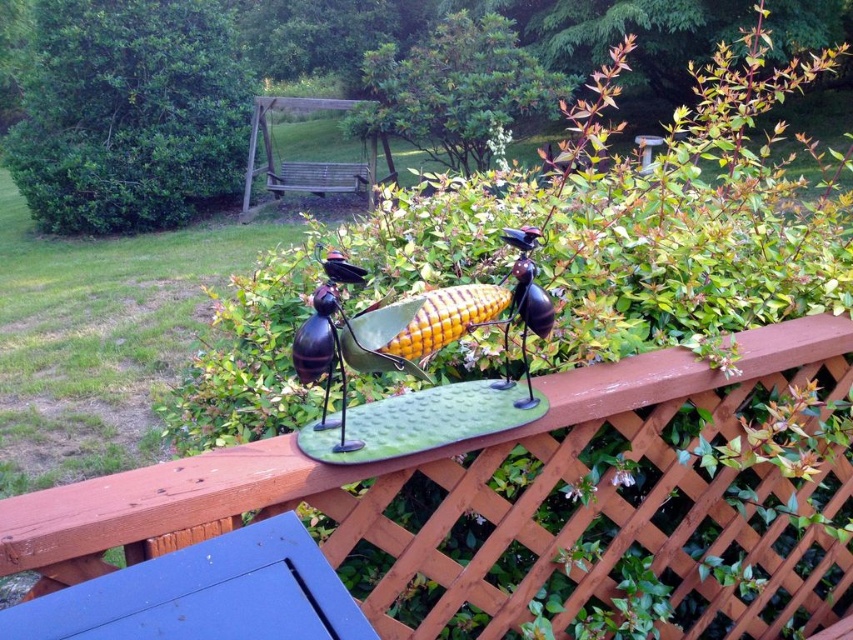
Does wooden lattice at center appear over green leafy bush at upper center?

Incorrect, wooden lattice at center is not positioned above green leafy bush at upper center.

This screenshot has width=853, height=640. What are the coordinates of `wooden lattice at center` in the screenshot? It's located at (x=473, y=497).

Is point (126, 506) farther from camera compared to point (503, 49)?

No, it is in front of (503, 49).

You are a GUI agent. You are given a task and a screenshot of the screen. Output one action in this format:
    pyautogui.click(x=<x>, y=<y>)
    Task: Click on the wooden lattice at center
    This screenshot has width=853, height=640.
    Given the screenshot: What is the action you would take?
    pyautogui.click(x=473, y=497)

Does green leafy bush at upper left have a lesser height compared to green leafy bush at upper center?

Incorrect, green leafy bush at upper left's height does not fall short of green leafy bush at upper center's.

How much distance is there between green leafy bush at upper left and green leafy bush at upper center?

They are 10.48 feet apart.

Who is more forward, (219, 65) or (430, 68)?

Positioned in front is point (430, 68).

The image size is (853, 640). In order to click on green leafy bush at upper left in this screenshot , I will do `click(129, 115)`.

Image resolution: width=853 pixels, height=640 pixels. I want to click on wooden lattice at center, so click(x=473, y=497).

Which is more to the right, wooden lattice at center or green leafy bush at upper left?

From the viewer's perspective, wooden lattice at center appears more on the right side.

Find the location of a particular element. Image resolution: width=853 pixels, height=640 pixels. wooden lattice at center is located at coordinates (473, 497).